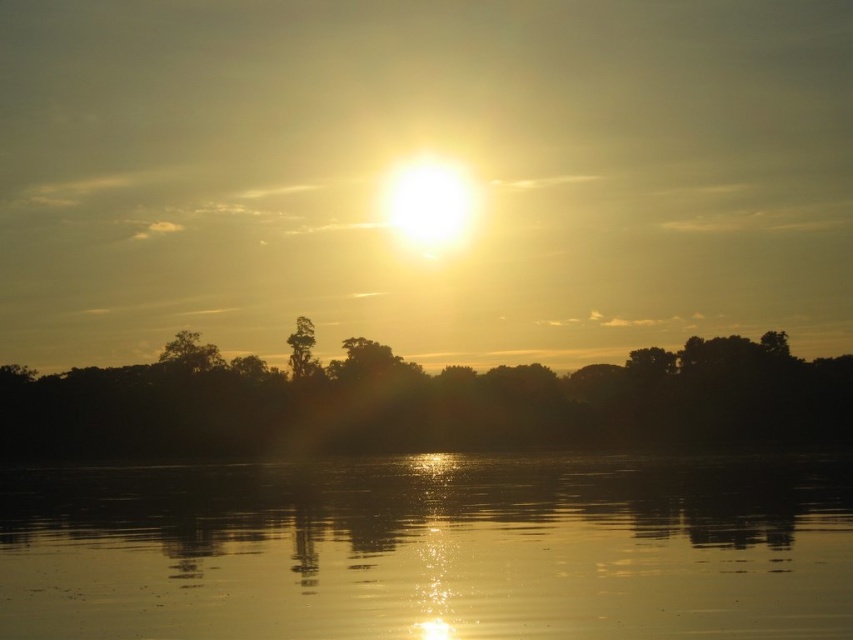
Question: Can you confirm if golden reflective water at center is thinner than green matte tree at center?

Choices:
 (A) no
 (B) yes

Answer: (A)

Question: Estimate the real-world distances between objects in this image. Which object is farther from the green matte tree at center?

Choices:
 (A) silhouette tree at center
 (B) green matte tree at left
 (C) golden reflective water at center

Answer: (C)

Question: Which object appears farthest from the camera in this image?

Choices:
 (A) green matte tree at center
 (B) silhouette tree at center
 (C) golden reflective water at center

Answer: (A)

Question: Which is nearer to the green matte tree at left?

Choices:
 (A) silhouette tree at center
 (B) green matte tree at center

Answer: (B)

Question: Does golden reflective water at center have a lesser width compared to green matte tree at center?

Choices:
 (A) no
 (B) yes

Answer: (A)

Question: Is golden reflective water at center bigger than green matte tree at left?

Choices:
 (A) yes
 (B) no

Answer: (A)